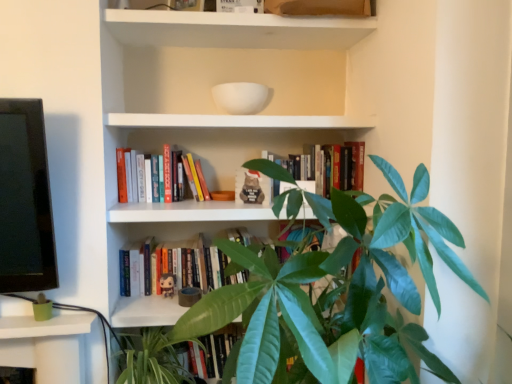
Question: In the image, is hardcover books at center, which is counted as the second book, starting from the top, positioned in front of or behind hardcover book at center, which is the 1th book in bottom-to-top order?

Choices:
 (A) behind
 (B) front

Answer: (B)

Question: Based on their sizes in the image, would you say hardcover books at center, which is counted as the second book, starting from the top, is bigger or smaller than hardcover book at center, which is the 3th book from top to bottom?

Choices:
 (A) small
 (B) big

Answer: (A)

Question: Which object is positioned farthest from the green glossy houseplant at center?

Choices:
 (A) hardcover books at center, which is the 2th book in bottom-to-top order
 (B) hardcover books at center, acting as the first book starting from the top
 (C) hardcover book at center, which is the 1th book in bottom-to-top order
 (D) green leafy plant at lower center

Answer: (A)

Question: Estimate the real-world distances between objects in this image. Which object is farther from the hardcover book at center, which is the 1th book in bottom-to-top order?

Choices:
 (A) hardcover books at center, which is counted as the second book, starting from the top
 (B) green leafy plant at lower center
 (C) green glossy houseplant at center
 (D) hardcover books at center, positioned as the 3th book in bottom-to-top order

Answer: (C)